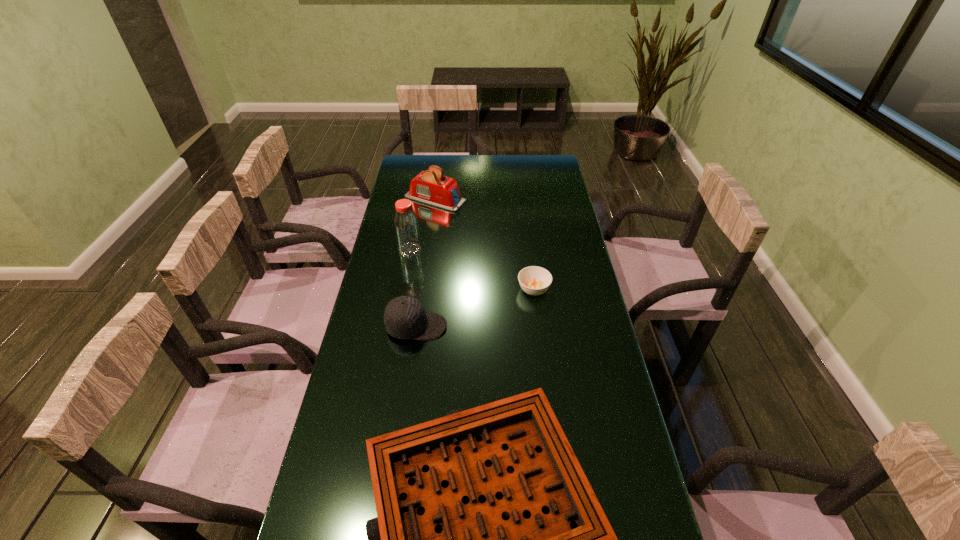
Identify the location of the tallest object. (406, 225).

You are a GUI agent. You are given a task and a screenshot of the screen. Output one action in this format:
    pyautogui.click(x=<x>, y=<y>)
    Task: Click on the second farthest object
    This screenshot has width=960, height=540.
    Given the screenshot: What is the action you would take?
    pyautogui.click(x=406, y=225)

Find the location of `toaster`. toaster is located at coordinates 430,187.

You are a GUI agent. You are given a task and a screenshot of the screen. Output one action in this format:
    pyautogui.click(x=<x>, y=<y>)
    Task: Click on the farthest object
    Image resolution: width=960 pixels, height=540 pixels.
    Given the screenshot: What is the action you would take?
    pyautogui.click(x=430, y=187)

Locate an element on the screen. The width and height of the screenshot is (960, 540). baseball cap is located at coordinates (405, 317).

Locate an element on the screen. soup bowl is located at coordinates (534, 280).

I want to click on the shortest object, so click(534, 280).

Find the location of a particular element. vacant space located 0.320m on the back of the fourth nearest object is located at coordinates (420, 197).

The height and width of the screenshot is (540, 960). Identify the location of blank space located 0.200m on the back of the fourth shortest object. (440, 165).

In order to click on vacant space located 0.400m at the front of the second nearest object where the brim is located in this screenshot , I will do `click(574, 327)`.